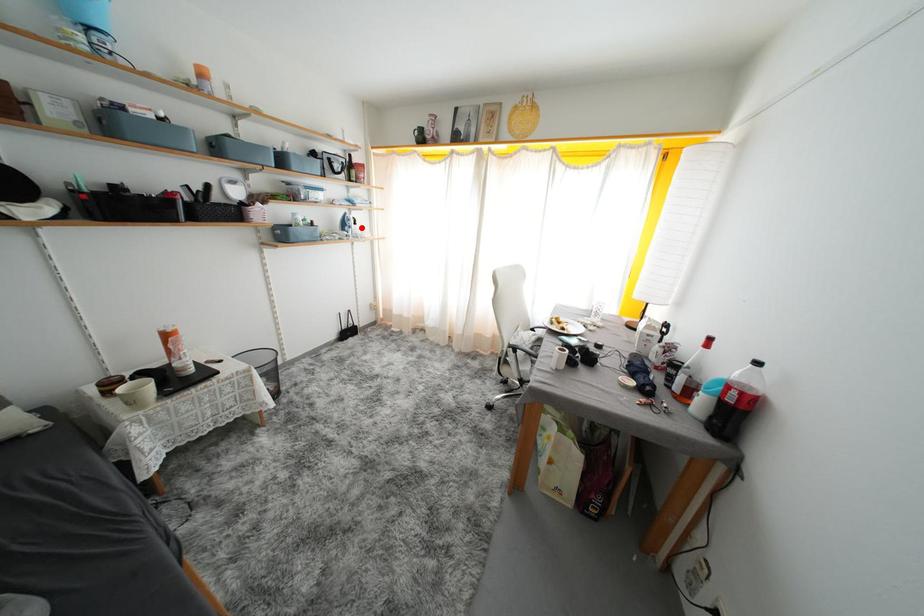
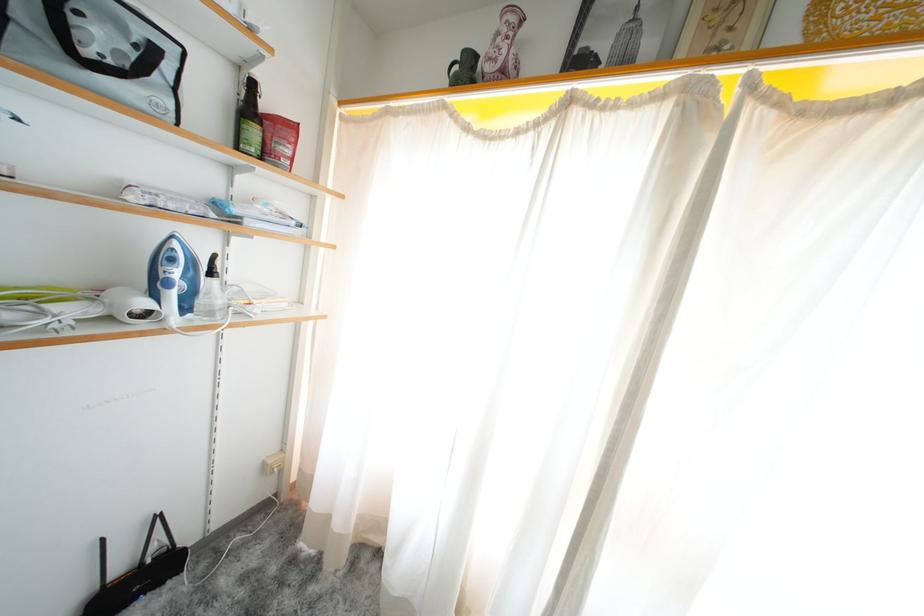
Question: I am providing you with two images of the same scene from different viewpoints. Given a red point in image1, look at the same physical point in image2. Is it:

Choices:
 (A) Closer to the viewpoint
 (B) Farther from the viewpoint

Answer: (B)